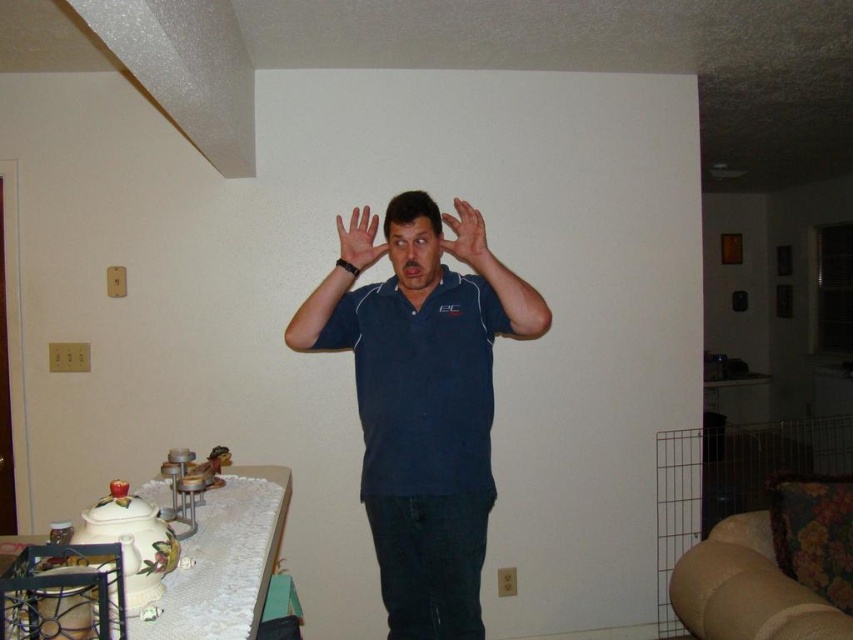
You are an interior designer observing the scene. You need to ensure that the matte blue shirt at center and the matte black hand at center are visible in a photograph. Which object should be positioned closer to the camera to ensure both are fully visible?

The matte blue shirt at center is shorter than the matte black hand at center. To ensure both are fully visible in the photograph, the matte blue shirt at center should be positioned closer to the camera since it is shorter and might otherwise be obscured by the taller matte black hand at center.